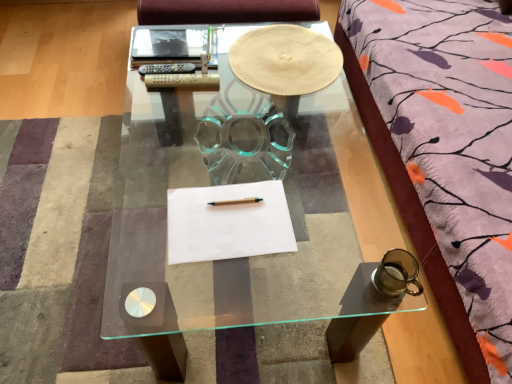
Question: From a real-world perspective, is white paper at center, which appears as the 2th notebook when viewed from the top, located higher than wooden pencil at center?

Choices:
 (A) yes
 (B) no

Answer: (B)

Question: Considering the relative sizes of white paper at center, which appears as the 2th notebook when viewed from the top, and wooden pencil at center in the image provided, is white paper at center, which appears as the 2th notebook when viewed from the top, shorter than wooden pencil at center?

Choices:
 (A) yes
 (B) no

Answer: (A)

Question: Can you confirm if white paper at center, which appears as the 2th notebook when viewed from the top, is wider than wooden pencil at center?

Choices:
 (A) yes
 (B) no

Answer: (A)

Question: Considering the relative sizes of white paper at center, which appears as the 2th notebook when viewed from the top, and wooden pencil at center in the image provided, is white paper at center, which appears as the 2th notebook when viewed from the top, smaller than wooden pencil at center?

Choices:
 (A) no
 (B) yes

Answer: (A)

Question: Could you tell me if white paper at center, which appears as the 1th notebook when viewed from the front, is turned towards wooden pencil at center?

Choices:
 (A) yes
 (B) no

Answer: (B)

Question: From a real-world perspective, is transparent glass coffee table at center above or below wooden pencil at center?

Choices:
 (A) below
 (B) above

Answer: (A)

Question: Would you say transparent glass coffee table at center is to the left or to the right of wooden pencil at center in the picture?

Choices:
 (A) left
 (B) right

Answer: (A)

Question: From the image's perspective, is transparent glass coffee table at center above or below wooden pencil at center?

Choices:
 (A) above
 (B) below

Answer: (A)

Question: Is transparent glass coffee table at center inside or outside of wooden pencil at center?

Choices:
 (A) inside
 (B) outside

Answer: (B)

Question: In terms of width, does wooden pencil at center look wider or thinner when compared to white paper at center, which is the first notebook from bottom to top?

Choices:
 (A) thin
 (B) wide

Answer: (A)

Question: Is wooden pencil at center taller or shorter than white paper at center, which appears as the 2th notebook when viewed from the top?

Choices:
 (A) short
 (B) tall

Answer: (B)

Question: From the image's perspective, is wooden pencil at center located above or below white paper at center, the 2th notebook positioned from the back?

Choices:
 (A) below
 (B) above

Answer: (B)

Question: Based on their sizes in the image, would you say wooden pencil at center is bigger or smaller than white paper at center, which appears as the 1th notebook when viewed from the front?

Choices:
 (A) big
 (B) small

Answer: (B)

Question: In the image, is white paper at upper center, the 2th notebook when ordered from front to back, on the left side or the right side of transparent glass coffee table at center?

Choices:
 (A) right
 (B) left

Answer: (A)

Question: From their relative heights in the image, would you say white paper at upper center, acting as the 2th notebook starting from the bottom, is taller or shorter than transparent glass coffee table at center?

Choices:
 (A) tall
 (B) short

Answer: (B)